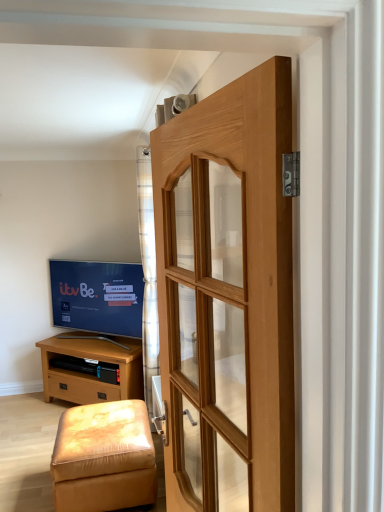
Where is `free point above leather-like beige stool at lower left (from a real-world perspective)`? free point above leather-like beige stool at lower left (from a real-world perspective) is located at coordinates (103, 423).